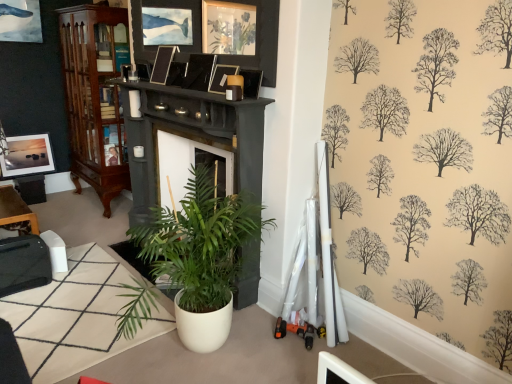
Question: From the image's perspective, is black glossy picture frame at upper center, which is counted as the 4th picture frame, starting from the back, below matte black picture frame at upper center, placed as the third picture frame when sorted from right to left?

Choices:
 (A) yes
 (B) no

Answer: (A)

Question: Would you say black glossy picture frame at upper center, the 2th picture frame viewed from the right, is a long distance from matte black picture frame at upper center, positioned as the third picture frame in front-to-back order?

Choices:
 (A) yes
 (B) no

Answer: (B)

Question: From a real-world perspective, is black glossy picture frame at upper center, the 2th picture frame viewed from the right, over matte black picture frame at upper center, the third picture frame positioned from the left?

Choices:
 (A) no
 (B) yes

Answer: (B)

Question: Is black glossy picture frame at upper center, the 2th picture frame viewed from the right, to the left of matte black picture frame at upper center, the third picture frame positioned from the left, from the viewer's perspective?

Choices:
 (A) yes
 (B) no

Answer: (B)

Question: Can you confirm if black glossy picture frame at upper center, which is counted as the 4th picture frame, starting from the back, is wider than matte black picture frame at upper center, the third picture frame positioned from the left?

Choices:
 (A) yes
 (B) no

Answer: (B)

Question: Looking at the image, does matte silver picture frame at upper left, arranged as the 5th picture frame when viewed from the right, seem bigger or smaller compared to matte black picture frame at upper center, which appears as the 5th picture frame when viewed from the left?

Choices:
 (A) small
 (B) big

Answer: (B)

Question: From their relative heights in the image, would you say matte silver picture frame at upper left, which ranks as the first picture frame in left-to-right order, is taller or shorter than matte black picture frame at upper center, which appears as the 5th picture frame when viewed from the left?

Choices:
 (A) tall
 (B) short

Answer: (A)

Question: Is matte silver picture frame at upper left, which ranks as the first picture frame in left-to-right order, situated inside matte black picture frame at upper center, which appears as the 5th picture frame when viewed from the left, or outside?

Choices:
 (A) inside
 (B) outside

Answer: (B)

Question: From the image's perspective, relative to matte black picture frame at upper center, which appears as the 5th picture frame when viewed from the left, is matte silver picture frame at upper left, arranged as the 5th picture frame when viewed from the right, above or below?

Choices:
 (A) below
 (B) above

Answer: (A)

Question: Is point (33, 170) positioned closer to the camera than point (161, 46)?

Choices:
 (A) farther
 (B) closer

Answer: (A)

Question: Is matte silver picture frame at upper left, arranged as the 5th picture frame when viewed from the right, taller or shorter than satin black picture frame at upper center, which is the fourth picture frame in right-to-left order?

Choices:
 (A) tall
 (B) short

Answer: (A)

Question: Is matte silver picture frame at upper left, which is the 1th picture frame from back to front, bigger or smaller than satin black picture frame at upper center, arranged as the 4th picture frame when viewed from the front?

Choices:
 (A) big
 (B) small

Answer: (A)

Question: Considering the positions of matte silver picture frame at upper left, arranged as the 5th picture frame when viewed from the right, and satin black picture frame at upper center, which is the fourth picture frame in right-to-left order, in the image, is matte silver picture frame at upper left, arranged as the 5th picture frame when viewed from the right, wider or thinner than satin black picture frame at upper center, which is the fourth picture frame in right-to-left order,?

Choices:
 (A) thin
 (B) wide

Answer: (A)

Question: Considering the positions of white matte houseplant at center and brown wood cabinet at left in the image, is white matte houseplant at center taller or shorter than brown wood cabinet at left?

Choices:
 (A) short
 (B) tall

Answer: (A)

Question: Would you say white matte houseplant at center is inside or outside brown wood cabinet at left?

Choices:
 (A) inside
 (B) outside

Answer: (B)